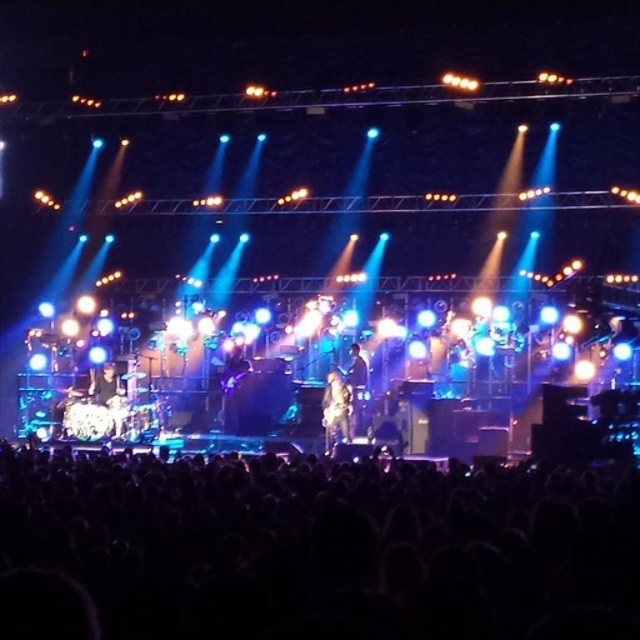
Between black matte crowd at lower center and metallic guitar at center, which one is positioned higher?

metallic guitar at center is higher up.

Does point (616, 506) come farther from viewer compared to point (364, 406)?

No, (616, 506) is closer to viewer.

What are the coordinates of `black matte crowd at lower center` in the screenshot? It's located at (330, 545).

Between point (228, 586) and point (336, 435), which one is positioned in front?

Point (228, 586) is in front.

Does black matte crowd at lower center come in front of camouflage-patterned shirt at center?

Yes.

Where is `black matte crowd at lower center`? black matte crowd at lower center is located at coordinates (330, 545).

Measure the distance between point (1, 563) and camera.

Point (1, 563) and camera are 21.39 meters apart from each other.

Can you confirm if black matte crowd at lower center is smaller than shiny black drum set at left?

No.

Is point (424, 502) less distant than point (104, 394)?

Yes, it is in front of point (104, 394).

The width and height of the screenshot is (640, 640). I want to click on black matte crowd at lower center, so click(330, 545).